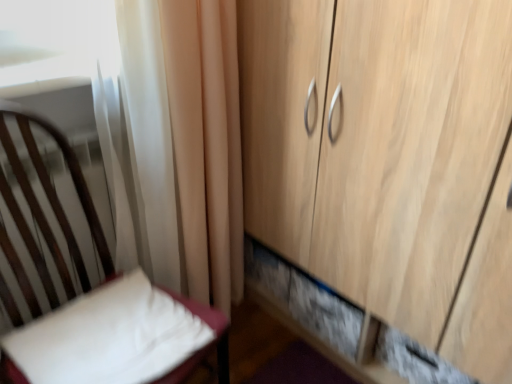
In order to face white soft pillow at lower left, should I rotate leftwards or rightwards?

Rotate your view left by about 19.502°.

What do you see at coordinates (48, 177) in the screenshot? This screenshot has height=384, width=512. I see `white fabric chair at left` at bounding box center [48, 177].

Image resolution: width=512 pixels, height=384 pixels. What do you see at coordinates (173, 141) in the screenshot? I see `white sheer curtain at upper left` at bounding box center [173, 141].

Identify the location of white soft pillow at lower left. (113, 336).

From a real-world perspective, is wooden cupboard at right physically located above or below white soft pillow at lower left?

Clearly, from a real-world perspective, wooden cupboard at right is above white soft pillow at lower left.

Which is less distant, (345, 179) or (157, 336)?

Point (345, 179) is positioned farther from the camera compared to point (157, 336).

Considering the sizes of objects wooden cupboard at right and white soft pillow at lower left in the image provided, who is taller, wooden cupboard at right or white soft pillow at lower left?

wooden cupboard at right is taller.

Consider the image. Is the depth of wooden cupboard at right less than that of white soft pillow at lower left?

Yes, the depth of wooden cupboard at right is less than that of white soft pillow at lower left.

Considering their positions, is white sheer curtain at upper left located in front of or behind white fabric chair at left?

In the image, white sheer curtain at upper left appears behind white fabric chair at left.

Who is taller, white sheer curtain at upper left or white fabric chair at left?

white sheer curtain at upper left.

Considering the sizes of objects white sheer curtain at upper left and white fabric chair at left in the image provided, who is thinner, white sheer curtain at upper left or white fabric chair at left?

With smaller width is white sheer curtain at upper left.

Is white sheer curtain at upper left at the back of white soft pillow at lower left?

No.

From a real-world perspective, who is located lower, white soft pillow at lower left or white sheer curtain at upper left?

white soft pillow at lower left, from a real-world perspective.

From the image's perspective, which is below, white soft pillow at lower left or white sheer curtain at upper left?

white soft pillow at lower left, from the image's perspective.

Can you see white soft pillow at lower left touching white sheer curtain at upper left?

No.

Between wooden cupboard at right and white sheer curtain at upper left, which one is positioned in front?

Positioned in front is wooden cupboard at right.

Would you say white sheer curtain at upper left is part of wooden cupboard at right's contents?

No, wooden cupboard at right does not contain white sheer curtain at upper left.

Considering the sizes of objects wooden cupboard at right and white sheer curtain at upper left in the image provided, who is smaller, wooden cupboard at right or white sheer curtain at upper left?

With smaller size is white sheer curtain at upper left.

Which is further, (x=374, y=186) or (x=217, y=156)?

Positioned behind is point (x=217, y=156).

Considering the relative sizes of white soft pillow at lower left and wooden cupboard at right in the image provided, is white soft pillow at lower left wider than wooden cupboard at right?

Incorrect, the width of white soft pillow at lower left does not surpass that of wooden cupboard at right.

From the image's perspective, is white soft pillow at lower left positioned above or below wooden cupboard at right?

white soft pillow at lower left is situated lower than wooden cupboard at right in the image.

Which object is further away from the camera, white soft pillow at lower left or wooden cupboard at right?

white soft pillow at lower left.

Is white soft pillow at lower left looking in the opposite direction of wooden cupboard at right?

white soft pillow at lower left is not turned away from wooden cupboard at right.

From the picture: Is white fabric chair at left oriented away from white sheer curtain at upper left?

white fabric chair at left is not turned away from white sheer curtain at upper left.

From the image's perspective, relative to white sheer curtain at upper left, is white fabric chair at left above or below?

Based on their image positions, white fabric chair at left is located beneath white sheer curtain at upper left.

From the picture: From a real-world perspective, which object stands above the other?

From a 3D spatial view, white sheer curtain at upper left is above.

Would you say white fabric chair at left is inside or outside white sheer curtain at upper left?

white fabric chair at left is located beyond the bounds of white sheer curtain at upper left.

At what (x,y) coordinates should I click in order to perform the action: click on pillow below the white fabric chair at left (from a real-world perspective). Please return your answer as a coordinate pair (x, y). Looking at the image, I should click on (113, 336).

Is white fabric chair at left in front of or behind white soft pillow at lower left in the image?

white fabric chair at left is in front of white soft pillow at lower left.

From the image's perspective, is white fabric chair at left located above or below white soft pillow at lower left?

From the image's perspective, white fabric chair at left appears above white soft pillow at lower left.

Looking at their sizes, would you say white fabric chair at left is wider or thinner than white soft pillow at lower left?

In the image, white fabric chair at left appears to be wider than white soft pillow at lower left.

Where is `cupboard that is on the right side of white soft pillow at lower left`? cupboard that is on the right side of white soft pillow at lower left is located at coordinates coord(386,169).

Image resolution: width=512 pixels, height=384 pixels. Find the location of `curtain above the white fabric chair at left (from a real-world perspective)`. curtain above the white fabric chair at left (from a real-world perspective) is located at coordinates (173, 141).

Based on their spatial positions, is white sheer curtain at upper left or white soft pillow at lower left further from white fabric chair at left?

white sheer curtain at upper left lies further to white fabric chair at left than the other object.

From the image, which object appears to be nearer to white sheer curtain at upper left, white soft pillow at lower left or white fabric chair at left?

white fabric chair at left.

Looking at the image, which one is located further to wooden cupboard at right, white soft pillow at lower left or white fabric chair at left?

white fabric chair at left is positioned further to the anchor wooden cupboard at right.

Based on their spatial positions, is white sheer curtain at upper left or white fabric chair at left further from wooden cupboard at right?

white fabric chair at left is further to wooden cupboard at right.

Considering their positions, is wooden cupboard at right positioned closer to white soft pillow at lower left than white fabric chair at left?

white fabric chair at left is closer to white soft pillow at lower left.

From the image, which object appears to be nearer to wooden cupboard at right, white fabric chair at left or white soft pillow at lower left?

white soft pillow at lower left is closer to wooden cupboard at right.

Consider the image. When comparing their distances from white sheer curtain at upper left, does white fabric chair at left or white soft pillow at lower left seem further?

Among the two, white soft pillow at lower left is located further to white sheer curtain at upper left.

Which object lies nearer to the anchor point white soft pillow at lower left, wooden cupboard at right or white sheer curtain at upper left?

white sheer curtain at upper left is closer to white soft pillow at lower left.

Where is `curtain between white fabric chair at left and wooden cupboard at right in the horizontal direction`? The height and width of the screenshot is (384, 512). curtain between white fabric chair at left and wooden cupboard at right in the horizontal direction is located at coordinates (173, 141).

Image resolution: width=512 pixels, height=384 pixels. In order to click on pillow between white fabric chair at left and wooden cupboard at right in this screenshot , I will do (x=113, y=336).

The image size is (512, 384). In order to click on curtain located between white soft pillow at lower left and wooden cupboard at right in the left-right direction in this screenshot , I will do `click(173, 141)`.

Locate an element on the screen. furniture between white sheer curtain at upper left and white soft pillow at lower left in the vertical direction is located at coordinates (48, 177).